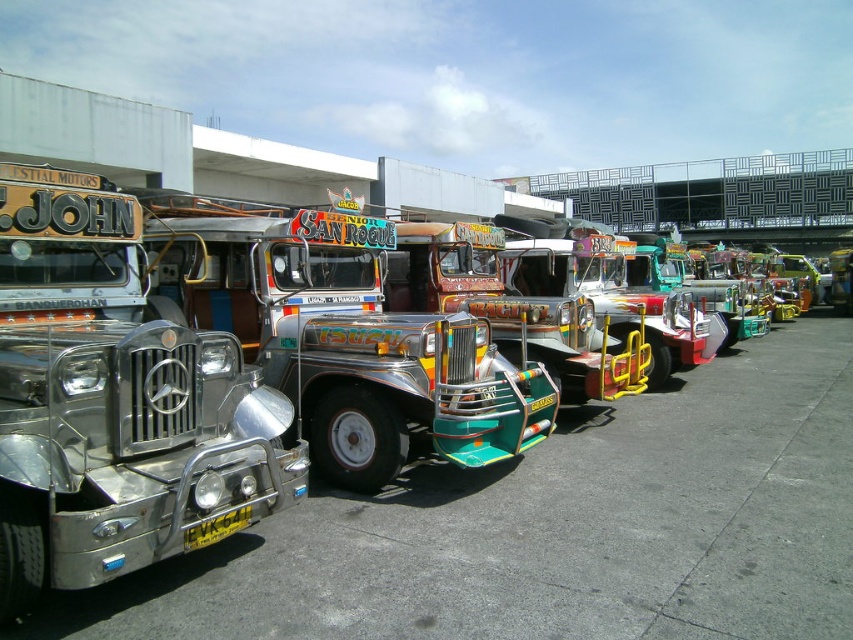
Who is taller, shiny metallic bus at left or shiny chrome trailer truck at center?

Standing taller between the two is shiny chrome trailer truck at center.

Is shiny metallic bus at left to the right of shiny chrome trailer truck at center from the viewer's perspective?

Yes, shiny metallic bus at left is to the right of shiny chrome trailer truck at center.

Does point (637, 429) come behind point (450, 432)?

Yes, it is.

Locate an element on the screen. shiny metallic bus at left is located at coordinates pos(555,529).

Is shiny metallic bus at left below shiny metallic bus at center?

Indeed, shiny metallic bus at left is positioned under shiny metallic bus at center.

Based on the photo, does shiny metallic bus at left appear on the left side of shiny metallic bus at center?

Incorrect, shiny metallic bus at left is not on the left side of shiny metallic bus at center.

Describe the element at coordinates (555, 529) in the screenshot. The image size is (853, 640). I see `shiny metallic bus at left` at that location.

You are a GUI agent. You are given a task and a screenshot of the screen. Output one action in this format:
    pyautogui.click(x=<x>, y=<y>)
    Task: Click on the shiny metallic bus at left
    The width and height of the screenshot is (853, 640).
    Given the screenshot: What is the action you would take?
    point(555,529)

Which is more to the left, shiny metallic bus at left or shiny silver trailer truck at left?

Positioned to the left is shiny silver trailer truck at left.

This screenshot has width=853, height=640. Find the location of `shiny metallic bus at left`. shiny metallic bus at left is located at coordinates (555, 529).

Locate an element on the screen. This screenshot has width=853, height=640. shiny metallic bus at left is located at coordinates (555, 529).

Find the location of a particular element. This screenshot has width=853, height=640. shiny metallic bus at left is located at coordinates (555, 529).